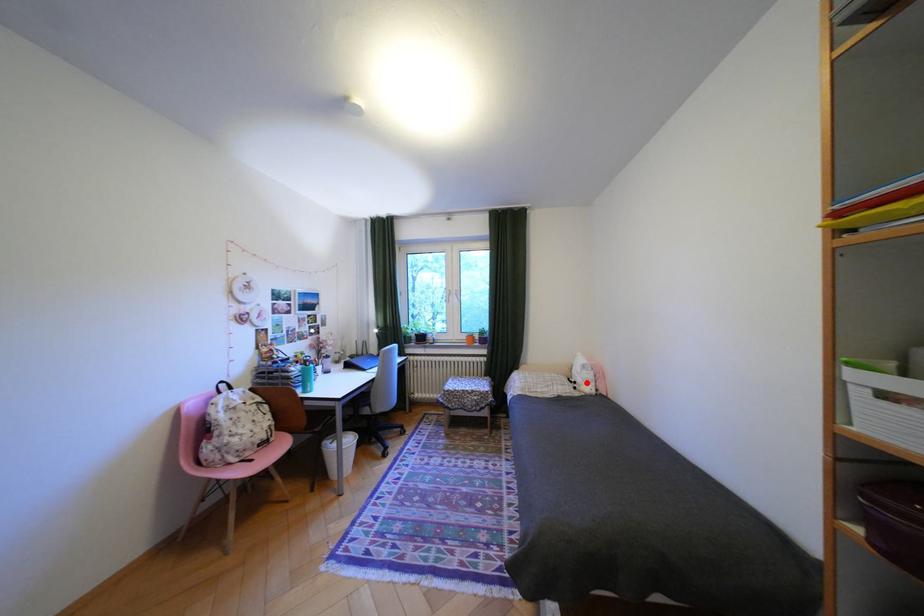
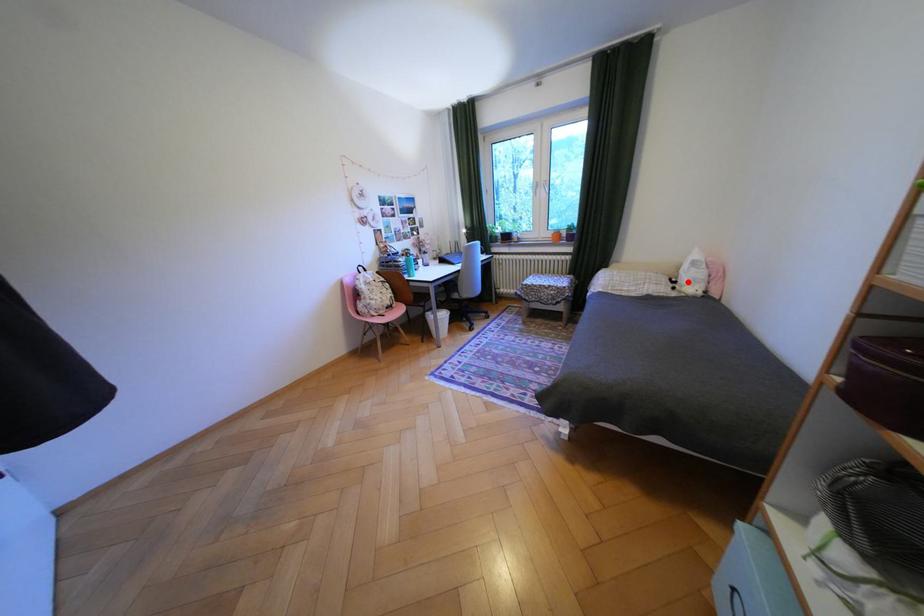
I am providing you with two images of the same scene from different viewpoints. A red point is marked on the first image and another point is marked on the second image. Is the red point in image1 aligned with the point shown in image2?

Yes